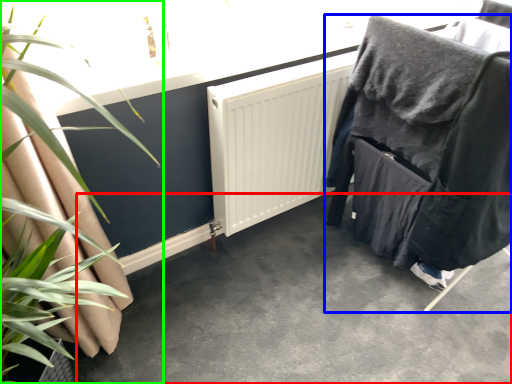
Question: Which object is positioned closest to concrete (highlighted by a red box)? Select from furniture (highlighted by a blue box) and houseplant (highlighted by a green box).

Choices:
 (A) furniture
 (B) houseplant

Answer: (A)